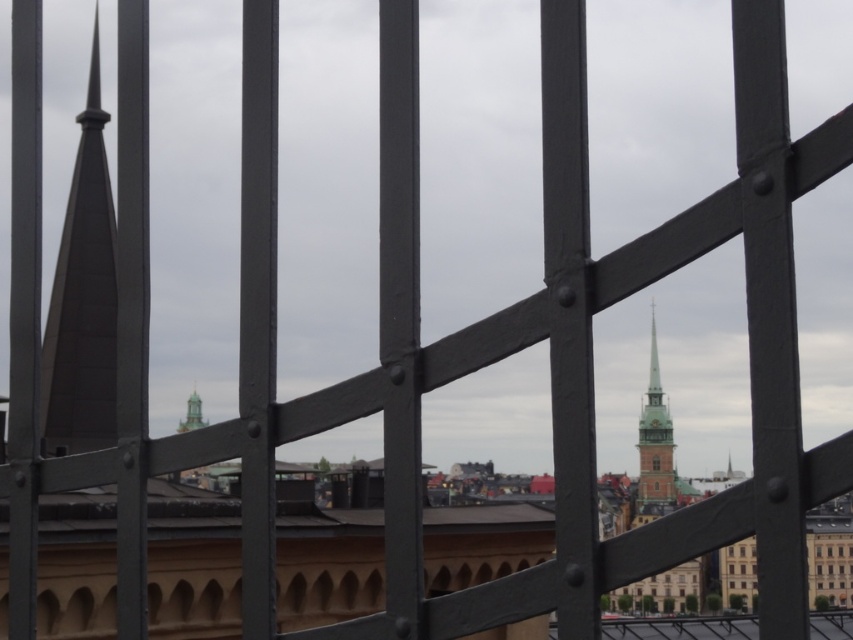
Between dark gray stone spire at left and greenish-brown stone spire at center-right, which one appears on the right side from the viewer's perspective?

Positioned to the right is greenish-brown stone spire at center-right.

Can you confirm if dark gray stone spire at left is smaller than greenish-brown stone spire at center-right?

Incorrect, dark gray stone spire at left is not smaller in size than greenish-brown stone spire at center-right.

You are a GUI agent. You are given a task and a screenshot of the screen. Output one action in this format:
    pyautogui.click(x=<x>, y=<y>)
    Task: Click on the dark gray stone spire at left
    This screenshot has height=640, width=853.
    Given the screenshot: What is the action you would take?
    pyautogui.click(x=82, y=298)

Where is `dark gray stone spire at left`? Image resolution: width=853 pixels, height=640 pixels. dark gray stone spire at left is located at coordinates (82, 298).